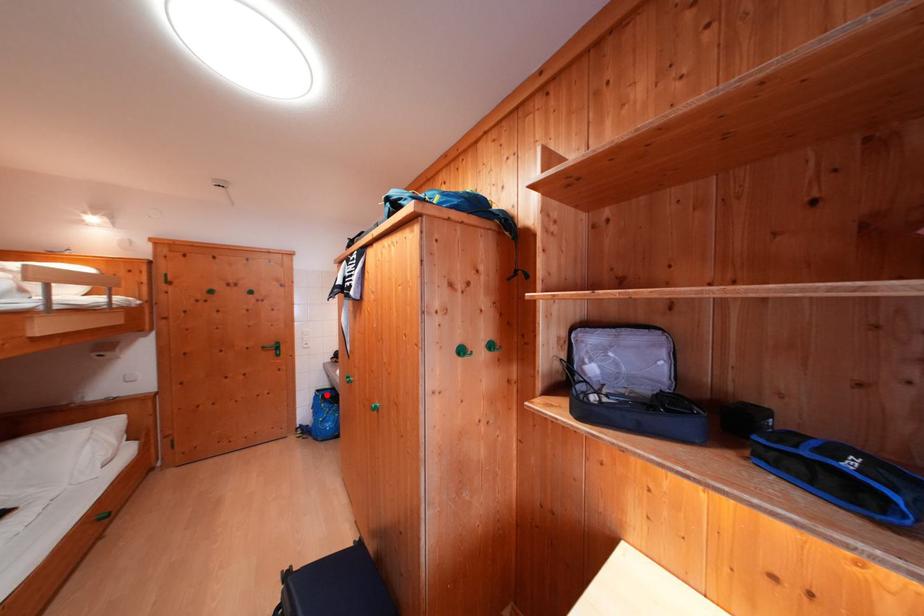
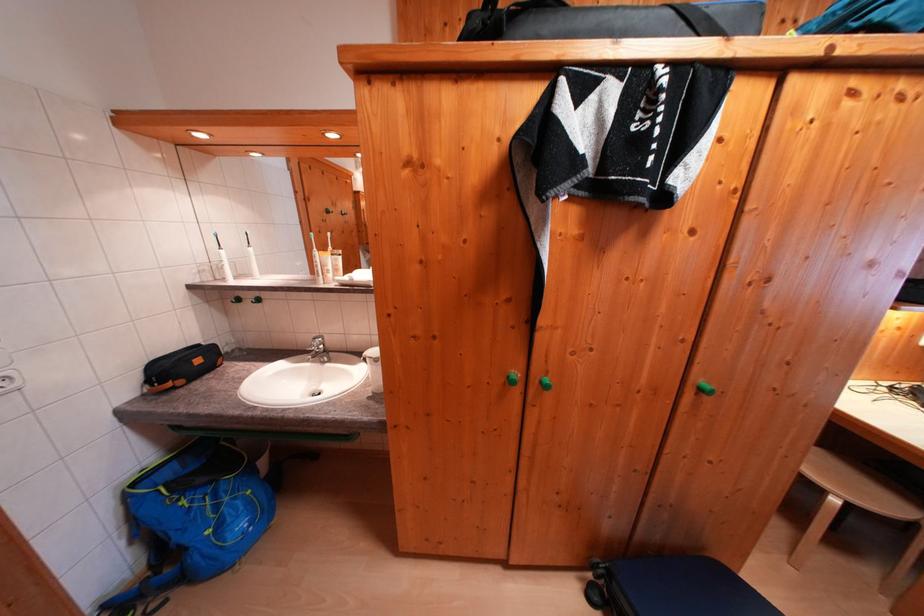
Question: A red point is marked in image1. In image2, is the corresponding 3D point closer to the camera or farther? Reply with the corresponding letter.

Choices:
 (A) The corresponding 3D point is closer.
 (B) The corresponding 3D point is farther.

Answer: (A)